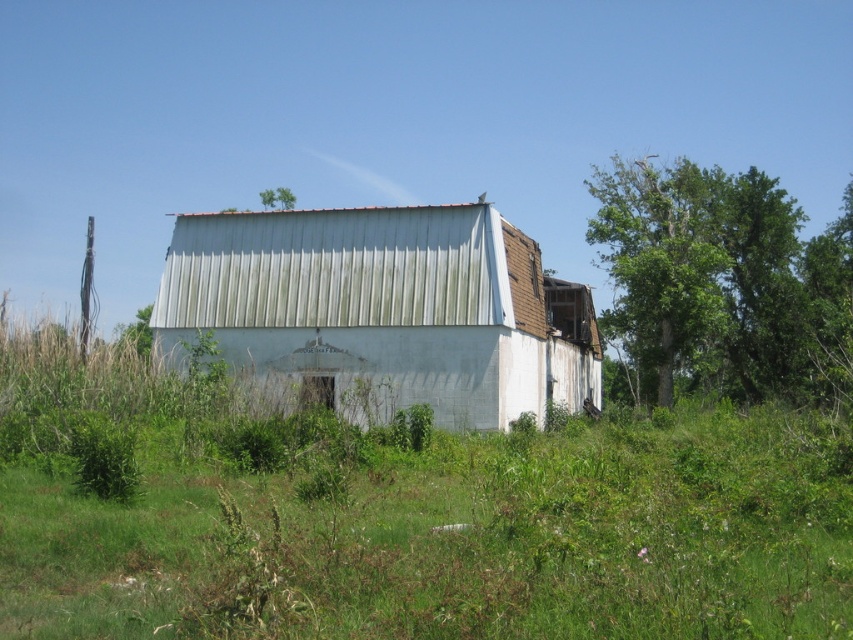
Question: Which point is farther to the camera?

Choices:
 (A) (166, 300)
 (B) (288, 196)

Answer: (B)

Question: Which object is farther from the camera taking this photo?

Choices:
 (A) green leafy tree at upper center
 (B) white corrugated metal barn at center
 (C) green leafy tree at right

Answer: (A)

Question: Is white corrugated metal barn at center bigger than green leafy tree at right?

Choices:
 (A) no
 (B) yes

Answer: (A)

Question: Can you confirm if green leafy tree at right is thinner than green leafy tree at upper center?

Choices:
 (A) yes
 (B) no

Answer: (B)

Question: Can you confirm if green leafy tree at right is smaller than green leafy tree at upper center?

Choices:
 (A) no
 (B) yes

Answer: (A)

Question: Which of these objects is positioned closest to the white corrugated metal barn at center?

Choices:
 (A) green leafy tree at upper center
 (B) green leafy tree at right

Answer: (B)